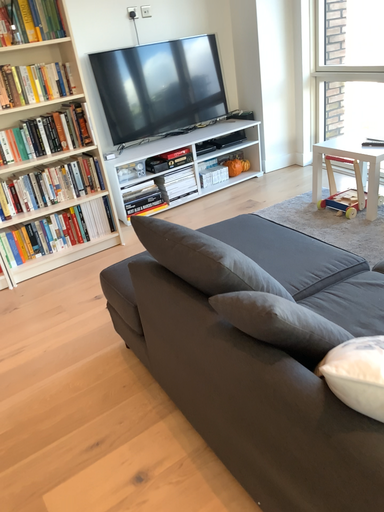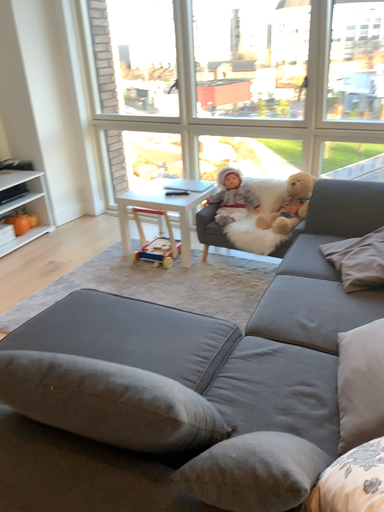
Question: Which way did the camera rotate in the video?

Choices:
 (A) rotated left
 (B) rotated right

Answer: (B)